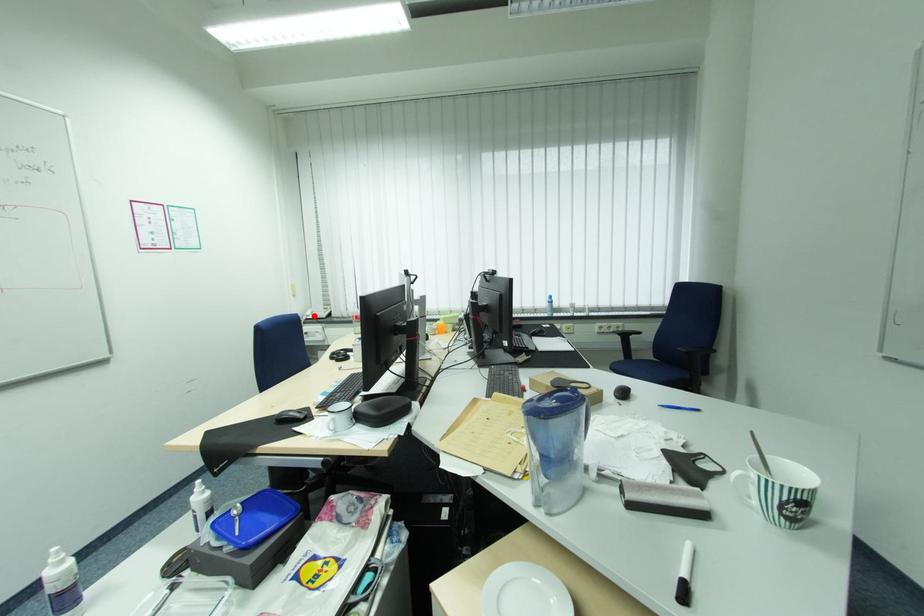
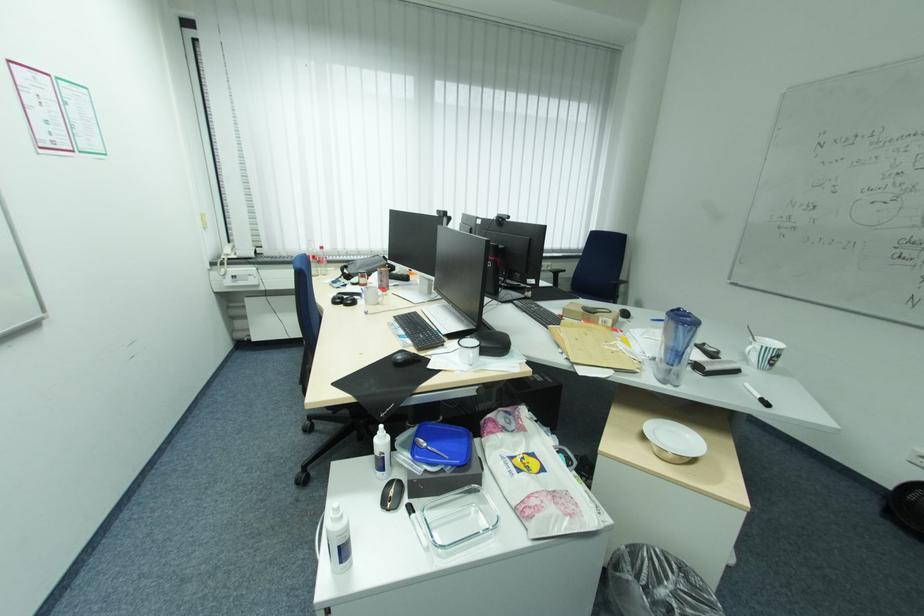
Find the pixel in the second image that matches the highlighted location in the first image.

(234, 254)